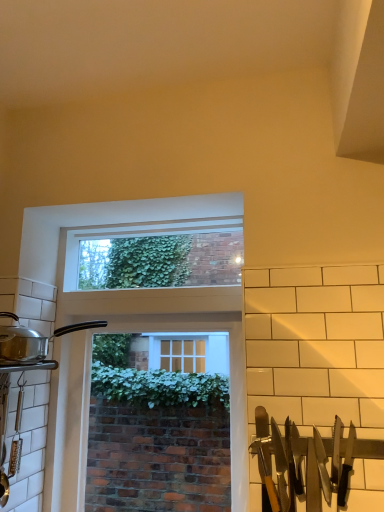
Question: Is silver/black handles at right spatially inside clear glass window at upper center, which appears as the 1th window screen when viewed from the top, or outside of it?

Choices:
 (A) outside
 (B) inside

Answer: (A)

Question: Considering the positions of silver/black handles at right and clear glass window at upper center, acting as the 2th window screen starting from the bottom, in the image, is silver/black handles at right wider or thinner than clear glass window at upper center, acting as the 2th window screen starting from the bottom,?

Choices:
 (A) wide
 (B) thin

Answer: (B)

Question: Estimate the real-world distances between objects in this image. Which object is closer to the silver metallic pot at left?

Choices:
 (A) silver/black handles at right
 (B) clear glass window at center, the 2th window screen viewed from the top
 (C) clear glass window at upper center, acting as the 2th window screen starting from the bottom

Answer: (C)

Question: Which object is the farthest from the silver metallic pot at left?

Choices:
 (A) clear glass window at upper center, which appears as the 1th window screen when viewed from the top
 (B) silver/black handles at right
 (C) clear glass window at center, the 2th window screen viewed from the top

Answer: (C)